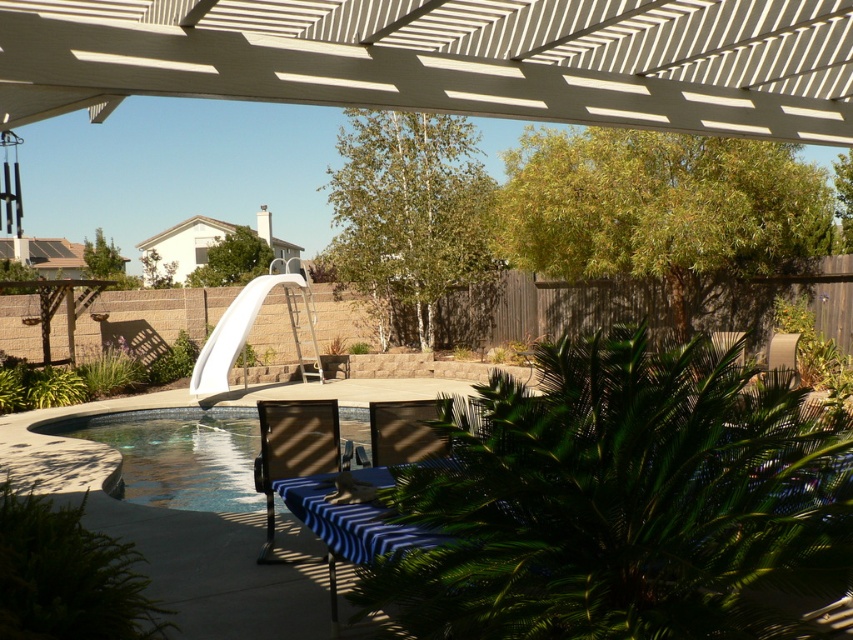
Does matte black chair at lower center have a greater height compared to white plastic slide at upper center?

No.

Measure the distance between matte black chair at lower center and camera.

17.64 feet

Between point (294, 460) and point (206, 355), which one is positioned in front?

Positioned in front is point (294, 460).

At what (x,y) coordinates should I click in order to perform the action: click on matte black chair at lower center. Please return your answer as a coordinate pair (x, y). The image size is (853, 640). Looking at the image, I should click on (293, 452).

Between white plastic slide at upper center and matte black chair at center, which one appears on the left side from the viewer's perspective?

white plastic slide at upper center

Who is higher up, white plastic slide at upper center or matte black chair at center?

white plastic slide at upper center

Between point (228, 337) and point (422, 428), which one is positioned in front?

Point (422, 428) is in front.

At what (x,y) coordinates should I click in order to perform the action: click on white plastic slide at upper center. Please return your answer as a coordinate pair (x, y). Image resolution: width=853 pixels, height=640 pixels. Looking at the image, I should click on (234, 332).

Does matte black chair at lower center appear over matte black chair at center?

Actually, matte black chair at lower center is below matte black chair at center.

Consider the image. Which is more to the left, matte black chair at lower center or matte black chair at center?

matte black chair at lower center

Identify the location of matte black chair at lower center. (293, 452).